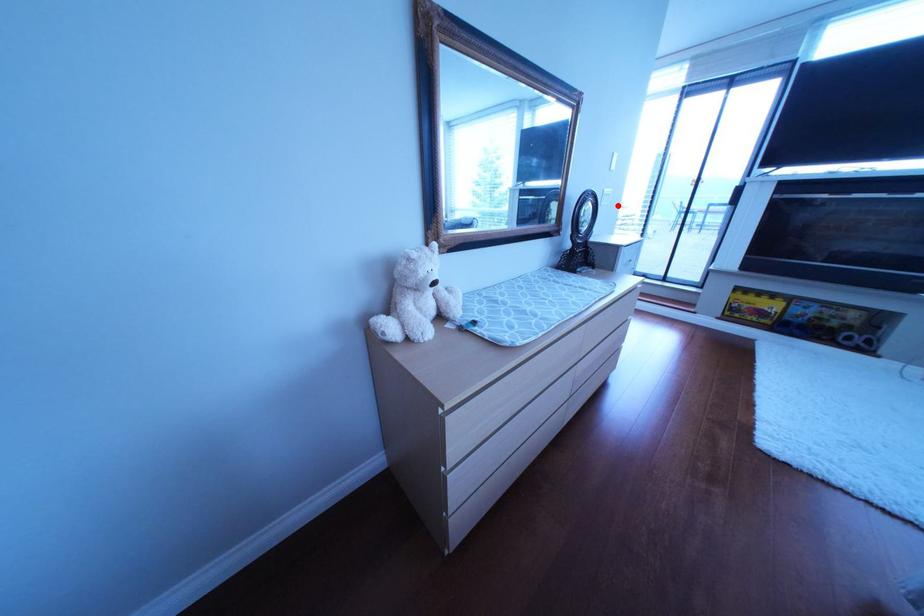
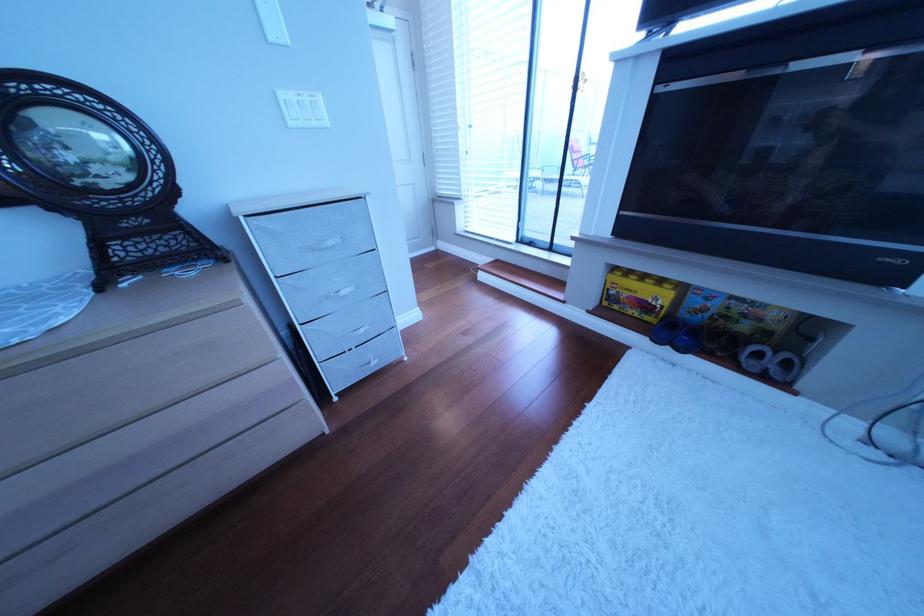
Where in the second image is the point corresponding to the highlighted location from the first image?

(307, 126)